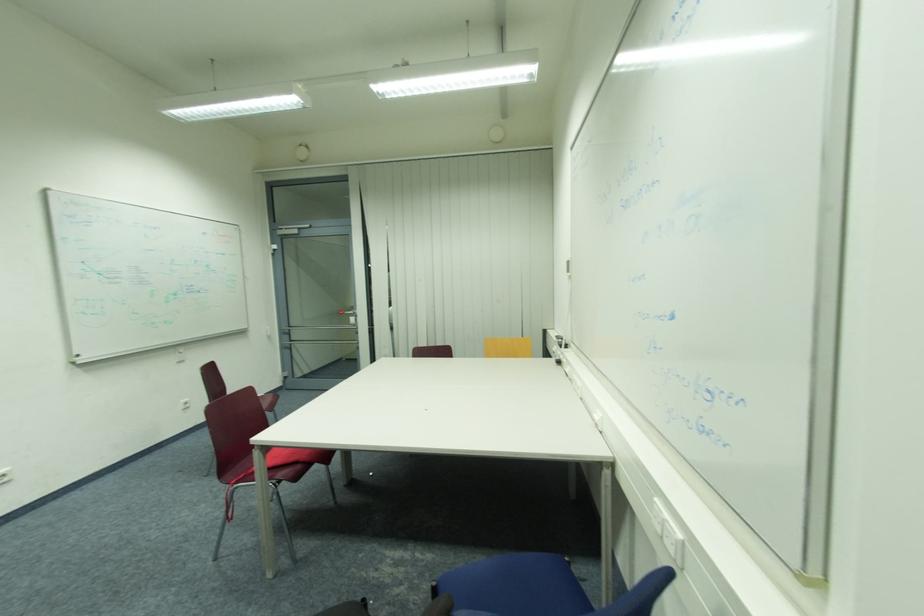
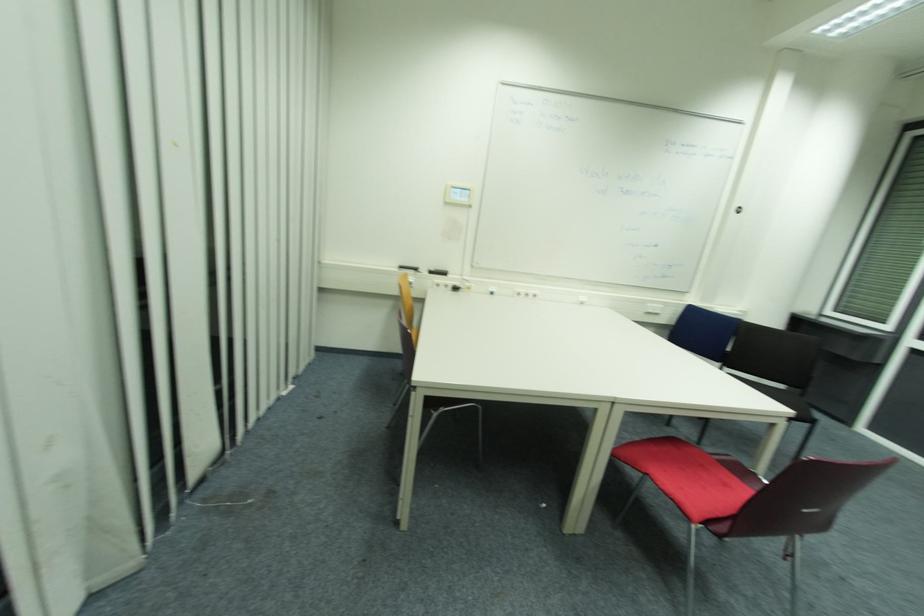
Locate, in the second image, the point that corresponds to (x=563, y=363) in the first image.

(458, 290)